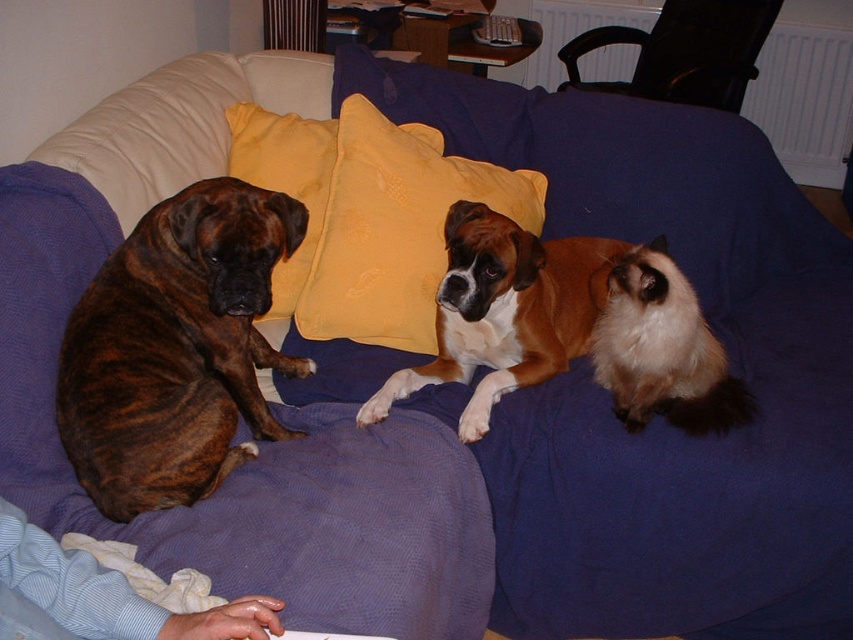
Can you confirm if yellow fabric pillow at center is wider than yellow fabric pillow at upper center?

Yes, yellow fabric pillow at center is wider than yellow fabric pillow at upper center.

Does yellow fabric pillow at center have a lesser height compared to yellow fabric pillow at upper center?

No, yellow fabric pillow at center is not shorter than yellow fabric pillow at upper center.

Identify the location of yellow fabric pillow at center. (395, 228).

Does brindle fur dog at left appear over brown shiny fur dog at center?

Actually, brindle fur dog at left is below brown shiny fur dog at center.

Where is `brindle fur dog at left`? brindle fur dog at left is located at coordinates (177, 348).

Which is more to the left, brown shiny fur dog at center or yellow fabric pillow at upper center?

yellow fabric pillow at upper center is more to the left.

Is brown shiny fur dog at center positioned before yellow fabric pillow at upper center?

Yes, it is in front of yellow fabric pillow at upper center.

You are a GUI agent. You are given a task and a screenshot of the screen. Output one action in this format:
    pyautogui.click(x=<x>, y=<y>)
    Task: Click on the brown shiny fur dog at center
    
    Given the screenshot: What is the action you would take?
    pyautogui.click(x=503, y=310)